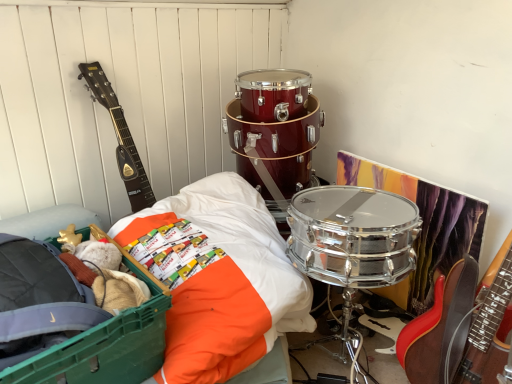
This screenshot has width=512, height=384. Describe the element at coordinates (120, 138) in the screenshot. I see `dark wood acoustic guitar at left` at that location.

Locate an element on the screen. green plastic storage box at lower left is located at coordinates (106, 346).

Where is `orange fabric bedsheet at center-left`? This screenshot has height=384, width=512. orange fabric bedsheet at center-left is located at coordinates (225, 282).

I want to click on guitar behind the orange fabric bedsheet at center-left, so click(x=120, y=138).

Considering the relative sizes of orange fabric bedsheet at center-left and dark wood acoustic guitar at left in the image provided, is orange fabric bedsheet at center-left smaller than dark wood acoustic guitar at left?

Actually, orange fabric bedsheet at center-left might be larger than dark wood acoustic guitar at left.

Looking at this image, can you tell me how much orange fabric bedsheet at center-left and dark wood acoustic guitar at left differ in facing direction?

The angle between the facing direction of orange fabric bedsheet at center-left and the facing direction of dark wood acoustic guitar at left is 3.03 degrees.

Considering the points (247, 224) and (117, 161), which point is in front, point (247, 224) or point (117, 161)?

The point (247, 224) is closer.

Does orange fabric bedsheet at center-left have a lesser height compared to green plastic storage box at lower left?

No, orange fabric bedsheet at center-left is not shorter than green plastic storage box at lower left.

Does orange fabric bedsheet at center-left turn towards green plastic storage box at lower left?

No, orange fabric bedsheet at center-left does not turn towards green plastic storage box at lower left.

Is orange fabric bedsheet at center-left to the left of green plastic storage box at lower left from the viewer's perspective?

No.

How many degrees apart are the facing directions of dark wood acoustic guitar at left and orange fabric bedsheet at center-left?

The angle between the facing direction of dark wood acoustic guitar at left and the facing direction of orange fabric bedsheet at center-left is 3.03 degrees.

Considering the sizes of dark wood acoustic guitar at left and orange fabric bedsheet at center-left in the image, is dark wood acoustic guitar at left bigger or smaller than orange fabric bedsheet at center-left?

Considering their sizes, dark wood acoustic guitar at left takes up less space than orange fabric bedsheet at center-left.

Between dark wood acoustic guitar at left and orange fabric bedsheet at center-left, which one has larger width?

orange fabric bedsheet at center-left.

Does dark wood acoustic guitar at left have a lesser height compared to orange fabric bedsheet at center-left?

No, dark wood acoustic guitar at left is not shorter than orange fabric bedsheet at center-left.

Which of these two, green plastic storage box at lower left or dark wood acoustic guitar at left, stands taller?

dark wood acoustic guitar at left is taller.

From the picture: Is green plastic storage box at lower left turned away from dark wood acoustic guitar at left?

green plastic storage box at lower left is not turned away from dark wood acoustic guitar at left.

Looking at their sizes, would you say green plastic storage box at lower left is wider or thinner than dark wood acoustic guitar at left?

In the image, green plastic storage box at lower left appears to be wider than dark wood acoustic guitar at left.

Which is behind, point (62, 349) or point (116, 106)?

Point (116, 106)

Looking at this image, does dark wood acoustic guitar at left have a larger size compared to green plastic storage box at lower left?

Incorrect, dark wood acoustic guitar at left is not larger than green plastic storage box at lower left.

Is dark wood acoustic guitar at left far away from green plastic storage box at lower left?

No, dark wood acoustic guitar at left is in close proximity to green plastic storage box at lower left.

Is dark wood acoustic guitar at left oriented away from green plastic storage box at lower left?

No, dark wood acoustic guitar at left is not facing the opposite direction of green plastic storage box at lower left.

Does dark wood acoustic guitar at left appear on the left side of green plastic storage box at lower left?

No, dark wood acoustic guitar at left is not to the left of green plastic storage box at lower left.

Based on the photo, from a real-world perspective, which is physically above, green plastic storage box at lower left or orange fabric bedsheet at center-left?

green plastic storage box at lower left is physically above.

The height and width of the screenshot is (384, 512). What are the coordinates of `sheet lying on the right of green plastic storage box at lower left` in the screenshot? It's located at (225, 282).

Is green plastic storage box at lower left far away from orange fabric bedsheet at center-left?

No, green plastic storage box at lower left is not far from orange fabric bedsheet at center-left.

In the image, is green plastic storage box at lower left positioned in front of or behind orange fabric bedsheet at center-left?

In the image, green plastic storage box at lower left appears in front of orange fabric bedsheet at center-left.

The width and height of the screenshot is (512, 384). In the image, there is a orange fabric bedsheet at center-left. In order to click on guitar above it (from the image's perspective) in this screenshot , I will do `click(120, 138)`.

The image size is (512, 384). I want to click on sheet located on the right of green plastic storage box at lower left, so click(x=225, y=282).

Which object lies further to the anchor point green plastic storage box at lower left, orange fabric bedsheet at center-left or dark wood acoustic guitar at left?

dark wood acoustic guitar at left is positioned further to the anchor green plastic storage box at lower left.

From the image, which object appears to be farther from dark wood acoustic guitar at left, orange fabric bedsheet at center-left or green plastic storage box at lower left?

The object further to dark wood acoustic guitar at left is green plastic storage box at lower left.

Estimate the real-world distances between objects in this image. Which object is closer to green plastic storage box at lower left, dark wood acoustic guitar at left or orange fabric bedsheet at center-left?

orange fabric bedsheet at center-left is closer to green plastic storage box at lower left.

Considering their positions, is green plastic storage box at lower left positioned closer to dark wood acoustic guitar at left than orange fabric bedsheet at center-left?

The object closer to dark wood acoustic guitar at left is orange fabric bedsheet at center-left.

Looking at the image, which one is located closer to orange fabric bedsheet at center-left, green plastic storage box at lower left or dark wood acoustic guitar at left?

Among the two, green plastic storage box at lower left is located nearer to orange fabric bedsheet at center-left.

Considering their positions, is dark wood acoustic guitar at left positioned further to orange fabric bedsheet at center-left than green plastic storage box at lower left?

dark wood acoustic guitar at left.

This screenshot has height=384, width=512. Find the location of `sheet between green plastic storage box at lower left and dark wood acoustic guitar at left along the z-axis`. sheet between green plastic storage box at lower left and dark wood acoustic guitar at left along the z-axis is located at coordinates (225, 282).